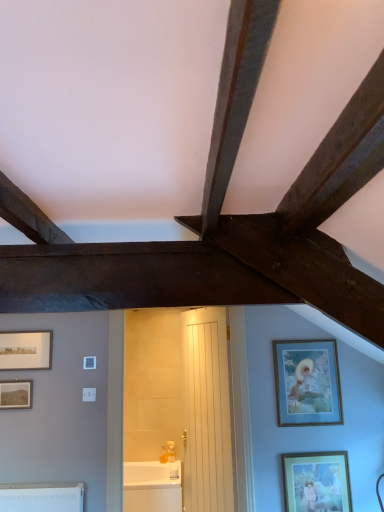
What do you see at coordinates (151, 487) in the screenshot? The width and height of the screenshot is (384, 512). I see `white glossy bathtub at center` at bounding box center [151, 487].

In order to face white wooden door at center, should I rotate leftwards or rightwards?

You should look right and rotate roughly 1.461 degrees.

What do you see at coordinates (307, 382) in the screenshot? The image size is (384, 512). I see `wooden frame at right, marked as the 3th picture frame in a bottom-to-top arrangement` at bounding box center [307, 382].

Find the location of `wooden frame at right, which ranks as the second picture frame in right-to-left order`. wooden frame at right, which ranks as the second picture frame in right-to-left order is located at coordinates (307, 382).

Find the location of a particular element. Image resolution: width=384 pixels, height=512 pixels. matte silver picture frame at left, which is the fourth picture frame in bottom-to-top order is located at coordinates (25, 350).

Would you say wooden frame at right, arranged as the 2th picture frame when viewed from the top, contains matte brown picture frame at lower left, acting as the second picture frame starting from the left?

Definitely not — matte brown picture frame at lower left, acting as the second picture frame starting from the left, is not inside wooden frame at right, arranged as the 2th picture frame when viewed from the top.

Is wooden frame at right, which ranks as the second picture frame in right-to-left order, far away from matte brown picture frame at lower left, acting as the second picture frame starting from the left?

Yes, wooden frame at right, which ranks as the second picture frame in right-to-left order, is far from matte brown picture frame at lower left, acting as the second picture frame starting from the left.

Could you tell me if wooden frame at right, the third picture frame from the left, is turned towards matte brown picture frame at lower left, acting as the second picture frame starting from the left?

No, wooden frame at right, the third picture frame from the left, is not facing towards matte brown picture frame at lower left, acting as the second picture frame starting from the left.

Can you confirm if wooden frame at right, which ranks as the second picture frame in right-to-left order, is shorter than matte brown picture frame at lower left, placed as the 3th picture frame when sorted from top to bottom?

No.

How different are the orientations of white wooden door at center and white glossy bathtub at center in degrees?

They differ by 64.7 degrees in their facing directions.

Is white wooden door at center not near white glossy bathtub at center?

They are positioned close to each other.

Which of these two, white wooden door at center or white glossy bathtub at center, is wider?

Wider between the two is white glossy bathtub at center.

Considering the positions of point (205, 454) and point (150, 510), is point (205, 454) closer or farther from the camera than point (150, 510)?

Point (205, 454) is closer to the camera than point (150, 510).

Based on their positions, is white glossy bathtub at center located to the left or right of matte gold picture frame at lower right, acting as the fourth picture frame starting from the left?

From the image, it's evident that white glossy bathtub at center is to the left of matte gold picture frame at lower right, acting as the fourth picture frame starting from the left.

Considering the relative positions of white glossy bathtub at center and matte gold picture frame at lower right, which is the 4th picture frame from top to bottom, in the image provided, is white glossy bathtub at center in front of matte gold picture frame at lower right, which is the 4th picture frame from top to bottom,?

No, it is behind matte gold picture frame at lower right, which is the 4th picture frame from top to bottom.

Does white glossy bathtub at center turn towards matte gold picture frame at lower right, acting as the fourth picture frame starting from the left?

No, white glossy bathtub at center is not facing towards matte gold picture frame at lower right, acting as the fourth picture frame starting from the left.

Based on their sizes in the image, would you say white glossy bathtub at center is bigger or smaller than matte gold picture frame at lower right, acting as the fourth picture frame starting from the left?

In the image, white glossy bathtub at center appears to be larger than matte gold picture frame at lower right, acting as the fourth picture frame starting from the left.

Would you say matte brown picture frame at lower left, which is counted as the 3th picture frame, starting from the right, is inside or outside wooden frame at right, arranged as the 2th picture frame when viewed from the top?

matte brown picture frame at lower left, which is counted as the 3th picture frame, starting from the right, exists outside the volume of wooden frame at right, arranged as the 2th picture frame when viewed from the top.

How different are the orientations of matte brown picture frame at lower left, acting as the second picture frame starting from the left, and wooden frame at right, which ranks as the second picture frame in right-to-left order, in degrees?

matte brown picture frame at lower left, acting as the second picture frame starting from the left, and wooden frame at right, which ranks as the second picture frame in right-to-left order, are facing 0.00181 degrees away from each other.

In order to click on picture frame that is the 1st one when counting rightward from the matte brown picture frame at lower left, acting as the second picture frame starting from the left in this screenshot , I will do `click(307, 382)`.

Could you tell me if matte brown picture frame at lower left, placed as the 3th picture frame when sorted from top to bottom, is facing wooden frame at right, arranged as the 2th picture frame when viewed from the top?

No, matte brown picture frame at lower left, placed as the 3th picture frame when sorted from top to bottom, is not facing towards wooden frame at right, arranged as the 2th picture frame when viewed from the top.

Does white glossy bathtub at center touch white wooden door at center?

They are not placed beside each other.

Image resolution: width=384 pixels, height=512 pixels. In order to click on bathtub below the white wooden door at center (from the image's perspective) in this screenshot , I will do pyautogui.click(x=151, y=487).

From the picture: From the image's perspective, is white glossy bathtub at center located above or below white wooden door at center?

white glossy bathtub at center is situated lower than white wooden door at center in the image.

Is white glossy bathtub at center bigger than white wooden door at center?

Correct, white glossy bathtub at center is larger in size than white wooden door at center.

From the image's perspective, is white glossy bathtub at center located above or below matte silver picture frame at left, which is the fourth picture frame in bottom-to-top order?

white glossy bathtub at center is below matte silver picture frame at left, which is the fourth picture frame in bottom-to-top order.

Consider the image. Is white glossy bathtub at center inside the boundaries of matte silver picture frame at left, the fourth picture frame from the right, or outside?

white glossy bathtub at center is located beyond the bounds of matte silver picture frame at left, the fourth picture frame from the right.

Is white glossy bathtub at center taller than matte silver picture frame at left, which is the first picture frame in top-to-bottom order?

Yes.

Does point (158, 476) come closer to viewer compared to point (23, 340)?

No, it is behind (23, 340).

From a real-world perspective, is matte brown picture frame at lower left, acting as the second picture frame starting from the left, located beneath matte silver picture frame at left, the fourth picture frame from the right?

Yes, from a real-world perspective, matte brown picture frame at lower left, acting as the second picture frame starting from the left, is beneath matte silver picture frame at left, the fourth picture frame from the right.

Which object is thinner, matte brown picture frame at lower left, acting as the second picture frame starting from the left, or matte silver picture frame at left, the fourth picture frame from the right?

matte brown picture frame at lower left, acting as the second picture frame starting from the left.

Can you tell me how much matte brown picture frame at lower left, the second picture frame positioned from the bottom, and matte silver picture frame at left, which is the first picture frame in top-to-bottom order, differ in facing direction?

0.00315 degrees separate the facing orientations of matte brown picture frame at lower left, the second picture frame positioned from the bottom, and matte silver picture frame at left, which is the first picture frame in top-to-bottom order.

Is matte brown picture frame at lower left, which is counted as the 3th picture frame, starting from the right, oriented away from matte silver picture frame at left, which is the first picture frame in top-to-bottom order?

No, matte brown picture frame at lower left, which is counted as the 3th picture frame, starting from the right, is not facing away from matte silver picture frame at left, which is the first picture frame in top-to-bottom order.

Locate an element on the screen. The height and width of the screenshot is (512, 384). the 1st picture frame above the matte brown picture frame at lower left, acting as the second picture frame starting from the left (from a real-world perspective) is located at coordinates (307, 382).

Find the location of a particular element. The image size is (384, 512). door lying in front of the white glossy bathtub at center is located at coordinates (206, 412).

From the image, which object appears to be farther from matte silver picture frame at left, the fourth picture frame from the right, wooden frame at right, which ranks as the second picture frame in right-to-left order, or matte brown picture frame at lower left, acting as the second picture frame starting from the left?

wooden frame at right, which ranks as the second picture frame in right-to-left order.

Considering their positions, is white wooden door at center positioned further to white glossy bathtub at center than matte silver picture frame at left, the fourth picture frame from the right?

matte silver picture frame at left, the fourth picture frame from the right, is further to white glossy bathtub at center.

Based on their spatial positions, is matte silver picture frame at left, which is the 1th picture frame from left to right, or wooden frame at right, which ranks as the second picture frame in right-to-left order, further from white glossy bathtub at center?

→ matte silver picture frame at left, which is the 1th picture frame from left to right, lies further to white glossy bathtub at center than the other object.

Estimate the real-world distances between objects in this image. Which object is closer to white glossy bathtub at center, matte brown picture frame at lower left, acting as the second picture frame starting from the left, or matte silver picture frame at left, which is the first picture frame in top-to-bottom order?

matte brown picture frame at lower left, acting as the second picture frame starting from the left, is positioned closer to the anchor white glossy bathtub at center.

Estimate the real-world distances between objects in this image. Which object is closer to matte gold picture frame at lower right, which is the first picture frame in bottom-to-top order, white wooden door at center or matte silver picture frame at left, which is the fourth picture frame in bottom-to-top order?

white wooden door at center is positioned closer to the anchor matte gold picture frame at lower right, which is the first picture frame in bottom-to-top order.

Considering their positions, is matte brown picture frame at lower left, which is counted as the 3th picture frame, starting from the right, positioned closer to matte silver picture frame at left, which is the fourth picture frame in bottom-to-top order, than white wooden door at center?

matte brown picture frame at lower left, which is counted as the 3th picture frame, starting from the right, is closer to matte silver picture frame at left, which is the fourth picture frame in bottom-to-top order.

In the scene shown: From the image, which object appears to be nearer to white wooden door at center, matte silver picture frame at left, which is the first picture frame in top-to-bottom order, or matte gold picture frame at lower right, which is the first picture frame in bottom-to-top order?

matte gold picture frame at lower right, which is the first picture frame in bottom-to-top order, is closer to white wooden door at center.

Based on the photo, based on their spatial positions, is matte gold picture frame at lower right, which appears as the 1th picture frame when viewed from the right, or white glossy bathtub at center further from wooden frame at right, the third picture frame from the left?

Among the two, white glossy bathtub at center is located further to wooden frame at right, the third picture frame from the left.

Where is `door between matte silver picture frame at left, which is the first picture frame in top-to-bottom order, and wooden frame at right, which ranks as the second picture frame in right-to-left order, from left to right`? This screenshot has height=512, width=384. door between matte silver picture frame at left, which is the first picture frame in top-to-bottom order, and wooden frame at right, which ranks as the second picture frame in right-to-left order, from left to right is located at coordinates (206, 412).

Find the location of a particular element. picture frame between matte silver picture frame at left, which is the fourth picture frame in bottom-to-top order, and white wooden door at center, in the horizontal direction is located at coordinates (15, 394).

Image resolution: width=384 pixels, height=512 pixels. What are the coordinates of `door between matte brown picture frame at lower left, the second picture frame positioned from the bottom, and matte gold picture frame at lower right, which is the 4th picture frame from top to bottom, in the horizontal direction` in the screenshot? It's located at (206, 412).

Locate an element on the screen. The width and height of the screenshot is (384, 512). door between matte silver picture frame at left, which is the first picture frame in top-to-bottom order, and white glossy bathtub at center in the up-down direction is located at coordinates (206, 412).